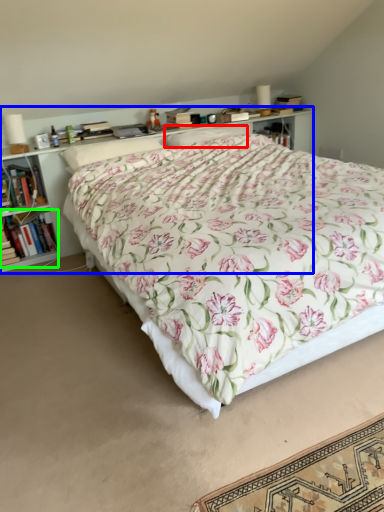
Question: Which is nearer to the pillow (highlighted by a red box)? shelf (highlighted by a blue box) or book (highlighted by a green box).

Choices:
 (A) shelf
 (B) book

Answer: (A)